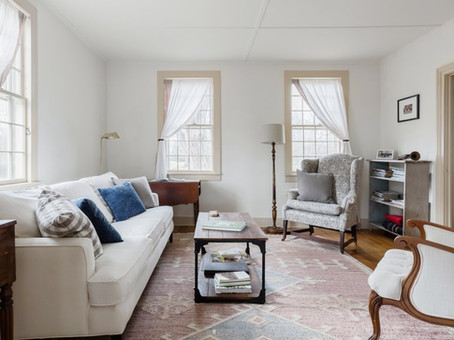
Image resolution: width=454 pixels, height=340 pixels. What are the coordinates of `rug` in the screenshot? It's located at (305, 296).